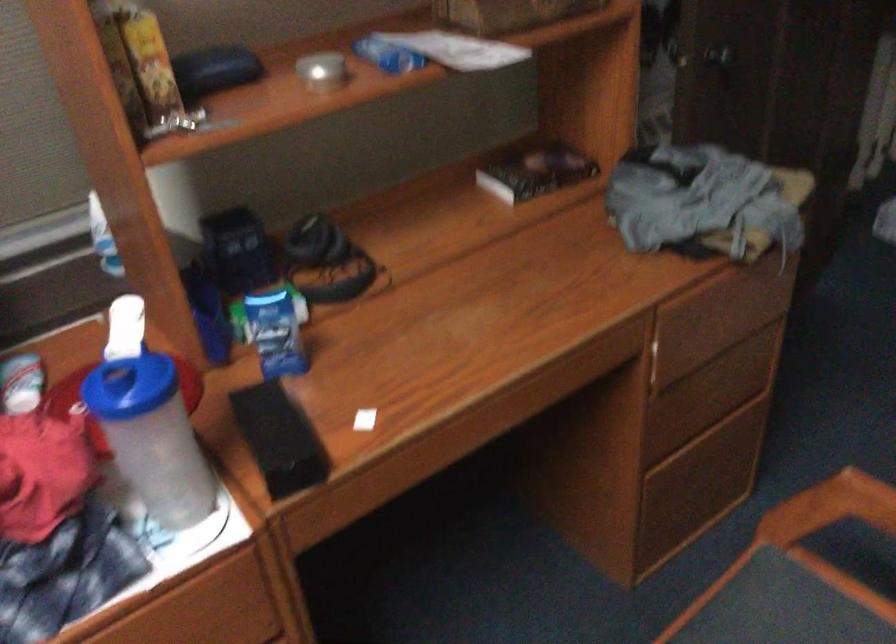
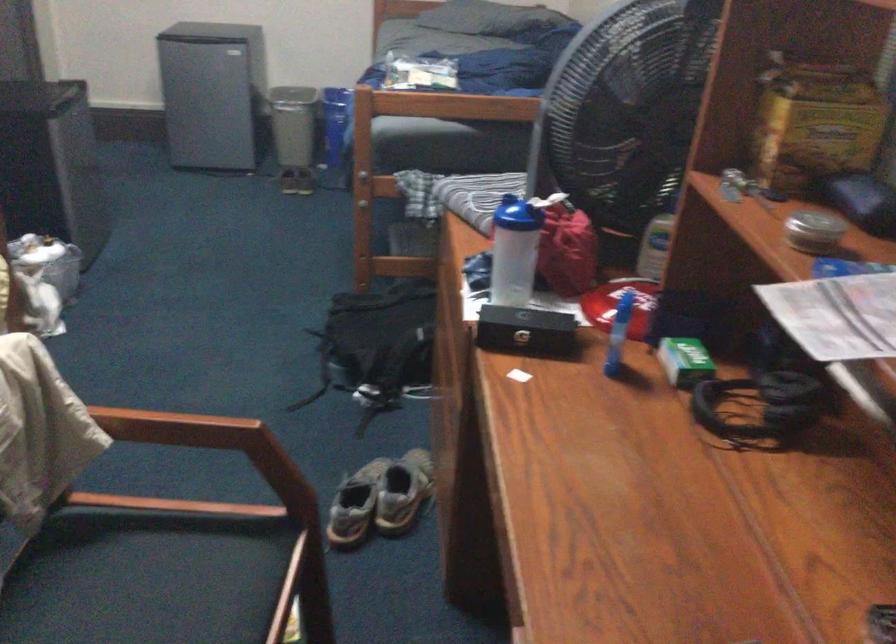
Find the pixel in the second image that matches (x=152, y=419) in the first image.

(513, 251)